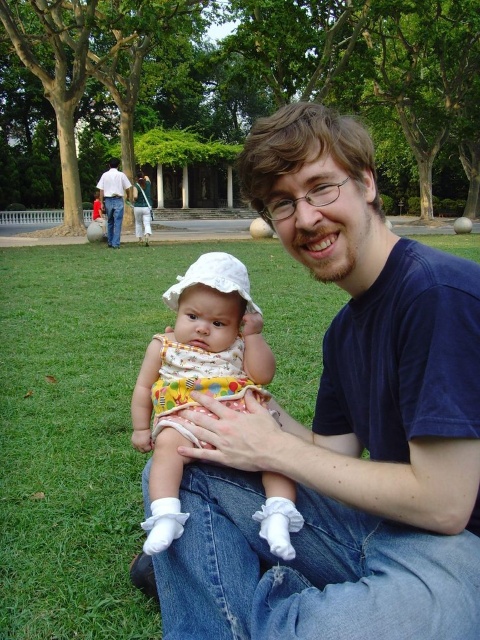
Question: Does blue cotton shirt at center have a greater width compared to printed cotton dress at center?

Choices:
 (A) yes
 (B) no

Answer: (A)

Question: Which point appears farthest from the camera in this image?

Choices:
 (A) (113, 234)
 (B) (244, 349)

Answer: (A)

Question: Does blue cotton shirt at center appear under printed cotton dress at center?

Choices:
 (A) no
 (B) yes

Answer: (A)

Question: Is printed cotton dress at center wider than denim jeans at center?

Choices:
 (A) no
 (B) yes

Answer: (A)

Question: Which of these objects is positioned closest to the printed cotton dress at center?

Choices:
 (A) blue cotton shirt at center
 (B) denim jeans at center

Answer: (A)

Question: Among these points, which one is farthest from the camera?

Choices:
 (A) (220, 317)
 (B) (391, 253)
 (C) (120, 227)

Answer: (C)